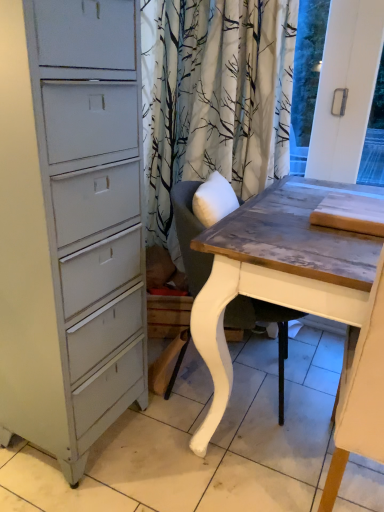
Question: Considering the relative positions of white painted wood chair at center and wooden table at right in the image provided, is white painted wood chair at center to the left or to the right of wooden table at right?

Choices:
 (A) left
 (B) right

Answer: (A)

Question: From a real-world perspective, is white painted wood chair at center physically located above or below wooden table at right?

Choices:
 (A) above
 (B) below

Answer: (B)

Question: Looking at their shapes, would you say white painted wood chair at center is wider or thinner than wooden table at right?

Choices:
 (A) wide
 (B) thin

Answer: (B)

Question: From their relative heights in the image, would you say wooden table at right is taller or shorter than white painted wood chair at center?

Choices:
 (A) tall
 (B) short

Answer: (A)

Question: Considering the positions of wooden table at right and white painted wood chair at center in the image, is wooden table at right wider or thinner than white painted wood chair at center?

Choices:
 (A) thin
 (B) wide

Answer: (B)

Question: From the image's perspective, is wooden table at right positioned above or below white painted wood chair at center?

Choices:
 (A) above
 (B) below

Answer: (B)

Question: Is wooden table at right inside or outside of white painted wood chair at center?

Choices:
 (A) outside
 (B) inside

Answer: (A)